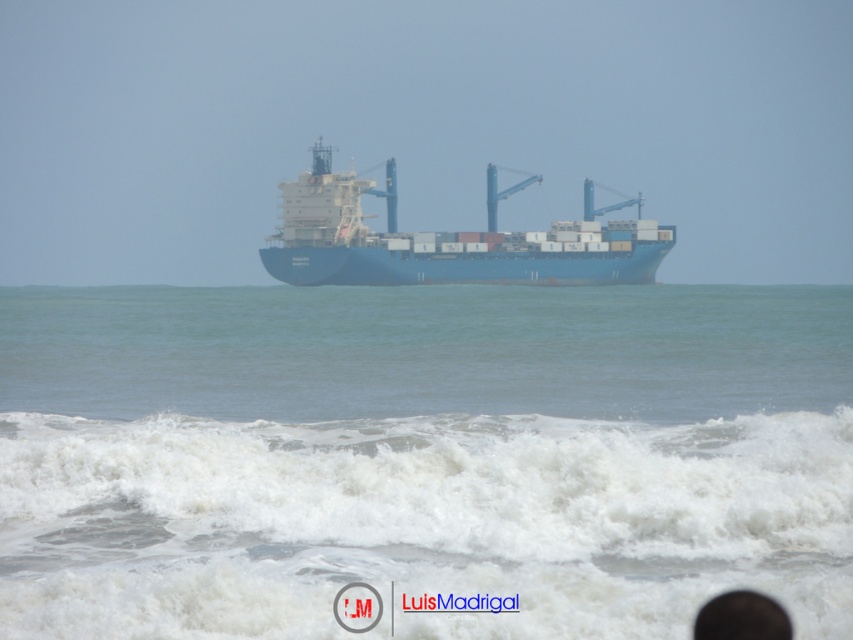
Question: Which object is closer to the camera taking this photo?

Choices:
 (A) white frothy wave at lower center
 (B) blue matte container ship at center

Answer: (A)

Question: Does blue water at center have a larger size compared to white frothy wave at lower center?

Choices:
 (A) yes
 (B) no

Answer: (A)

Question: Which point is closer to the camera?

Choices:
 (A) blue water at center
 (B) white frothy wave at lower center
 (C) blue matte container ship at center

Answer: (A)

Question: Is white frothy wave at lower center behind blue matte container ship at center?

Choices:
 (A) no
 (B) yes

Answer: (A)

Question: Considering the real-world distances, which object is farthest from the white frothy wave at lower center?

Choices:
 (A) blue water at center
 (B) blue matte container ship at center

Answer: (B)

Question: Is white frothy wave at lower center wider than blue matte container ship at center?

Choices:
 (A) yes
 (B) no

Answer: (B)